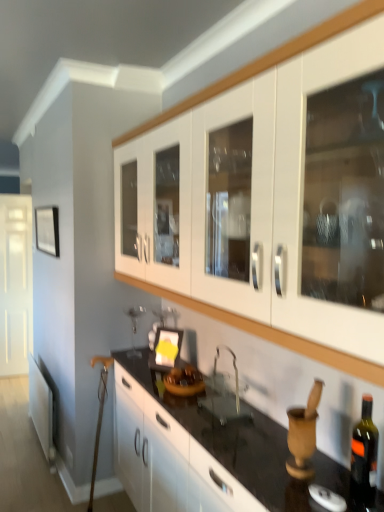
Question: Is white glossy door at left bigger or smaller than dark green glass bottle at lower right?

Choices:
 (A) small
 (B) big

Answer: (B)

Question: In terms of height, does white glossy door at left look taller or shorter compared to dark green glass bottle at lower right?

Choices:
 (A) tall
 (B) short

Answer: (A)

Question: Which of these objects is positioned farthest from the white glossy door at left?

Choices:
 (A) dark green glass bottle at lower right
 (B) clear glass sink at center
 (C) matte black picture frame at center, which is the 1th picture frame in bottom-to-top order
 (D) white glossy cabinets at upper center, which appears as the 2th cabinetry when ordered from the bottom
 (E) matte black picture frame at left, which is counted as the 2th picture frame, starting from the right

Answer: (A)

Question: Which is nearer to the matte black picture frame at center, which is the 1th picture frame in bottom-to-top order?

Choices:
 (A) black glossy countertop at center, which ranks as the 1th cabinetry in bottom-to-top order
 (B) dark green glass bottle at lower right
 (C) white glossy cabinets at upper center, which appears as the 2th cabinetry when ordered from the bottom
 (D) matte black picture frame at left, which ranks as the 1th picture frame in back-to-front order
 (E) white glossy door at left

Answer: (A)